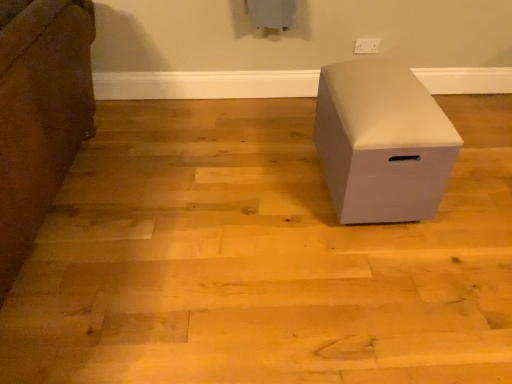
Question: Should I look upward or downward to see white plastic electric outlet at upper center?

Choices:
 (A) up
 (B) down

Answer: (A)

Question: From the image's perspective, is white matte storage box at center, which is the second furniture in right-to-left order, located above white matte storage box at center, positioned as the first furniture in right-to-left order?

Choices:
 (A) yes
 (B) no

Answer: (A)

Question: Is white matte storage box at center, the 2th furniture in the left-to-right sequence, completely or partially inside white matte storage box at center, which is the second furniture in right-to-left order?

Choices:
 (A) no
 (B) yes

Answer: (A)

Question: Is white matte storage box at center, which is the second furniture in right-to-left order, next to white matte storage box at center, the 2th furniture in the left-to-right sequence?

Choices:
 (A) no
 (B) yes

Answer: (A)

Question: Is white matte storage box at center, which is the 1th furniture from left to right, positioned before white matte storage box at center, positioned as the first furniture in right-to-left order?

Choices:
 (A) no
 (B) yes

Answer: (B)

Question: From the image's perspective, is white matte storage box at center, which is the 1th furniture from left to right, below white matte storage box at center, the 2th furniture in the left-to-right sequence?

Choices:
 (A) no
 (B) yes

Answer: (A)

Question: Can we say white matte storage box at center, which is the second furniture in right-to-left order, lies outside white matte storage box at center, positioned as the first furniture in right-to-left order?

Choices:
 (A) yes
 (B) no

Answer: (A)

Question: Is white matte storage box at center, positioned as the first furniture in right-to-left order, completely or partially inside white plastic electric outlet at upper center?

Choices:
 (A) yes
 (B) no

Answer: (B)

Question: From the image's perspective, is white plastic electric outlet at upper center under white matte storage box at center, the 2th furniture in the left-to-right sequence?

Choices:
 (A) yes
 (B) no

Answer: (B)

Question: Is white plastic electric outlet at upper center outside of white matte storage box at center, positioned as the first furniture in right-to-left order?

Choices:
 (A) no
 (B) yes

Answer: (B)

Question: Does white plastic electric outlet at upper center have a greater height compared to white matte storage box at center, positioned as the first furniture in right-to-left order?

Choices:
 (A) no
 (B) yes

Answer: (A)

Question: Is white plastic electric outlet at upper center directly adjacent to white matte storage box at center, the 2th furniture in the left-to-right sequence?

Choices:
 (A) no
 (B) yes

Answer: (A)

Question: Does white plastic electric outlet at upper center come behind white matte storage box at center, the 2th furniture in the left-to-right sequence?

Choices:
 (A) yes
 (B) no

Answer: (A)

Question: Is white plastic electric outlet at upper center outside white matte storage box at center, which is the second furniture in right-to-left order?

Choices:
 (A) no
 (B) yes

Answer: (B)